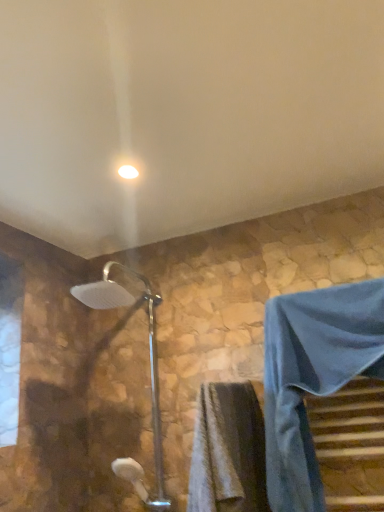
Question: From the image's perspective, is silver metallic shower head at center located above or below white glossy light fixture at upper center?

Choices:
 (A) below
 (B) above

Answer: (A)

Question: Looking at the image, does silver metallic shower head at center seem bigger or smaller compared to white glossy light fixture at upper center?

Choices:
 (A) small
 (B) big

Answer: (B)

Question: Which of these objects is positioned closest to the blue fabric robe at lower right?

Choices:
 (A) white glossy light fixture at upper center
 (B) silver metallic shower head at center
 (C) gray textured towel at lower center

Answer: (C)

Question: Which object is the farthest from the white glossy light fixture at upper center?

Choices:
 (A) gray textured towel at lower center
 (B) blue fabric robe at lower right
 (C) silver metallic shower head at center

Answer: (A)